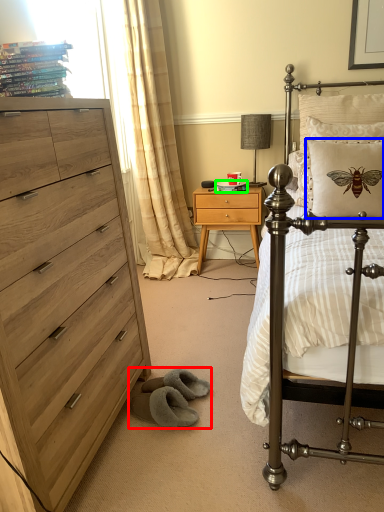
Question: Estimate the real-world distances between objects in this image. Which object is closer to gray (highlighted by a red box), pillow (highlighted by a blue box) or magazine (highlighted by a green box)?

Choices:
 (A) pillow
 (B) magazine

Answer: (A)